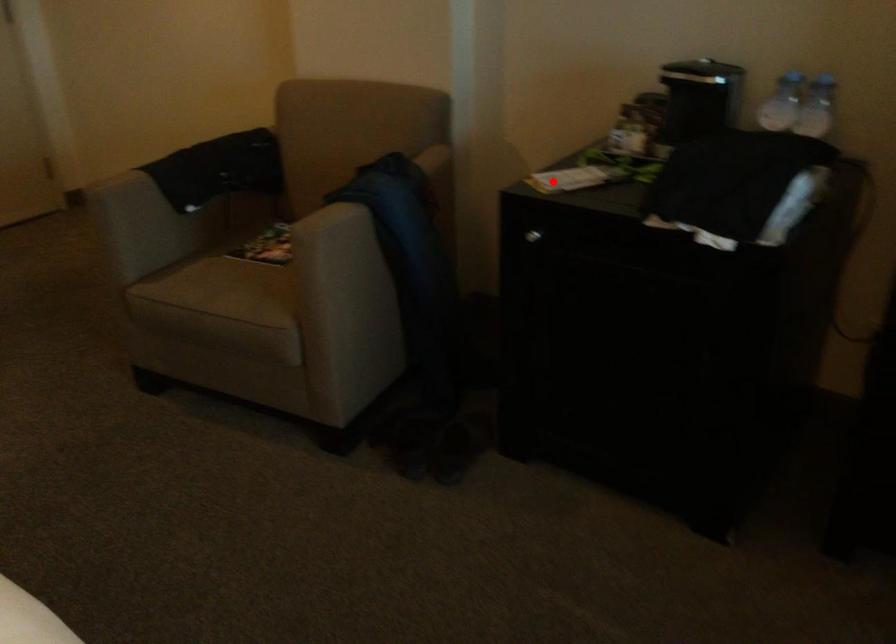
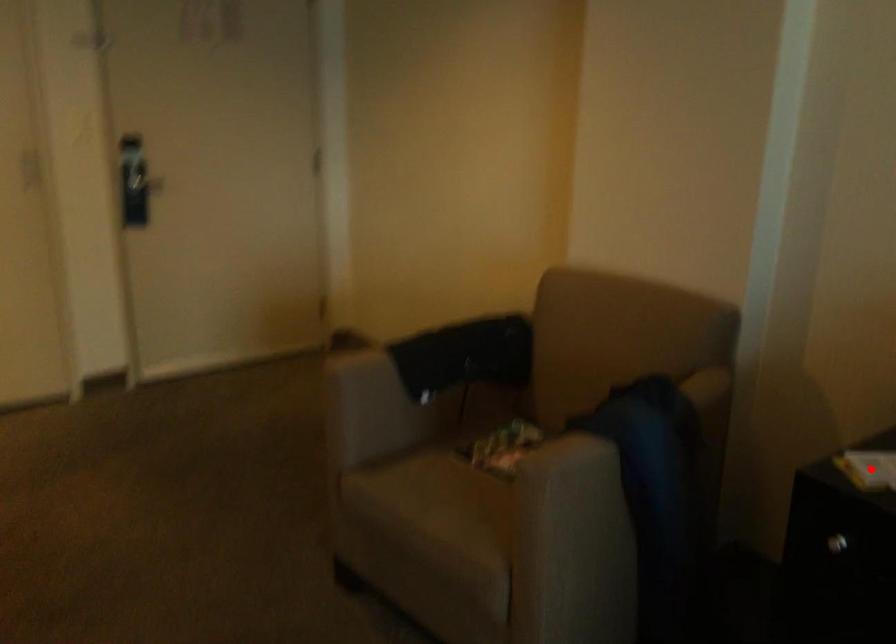
I am providing you with two images of the same scene from different viewpoints. A red point is marked on the first image and another point is marked on the second image. Is the marked point in image1 the same physical position as the marked point in image2?

Yes